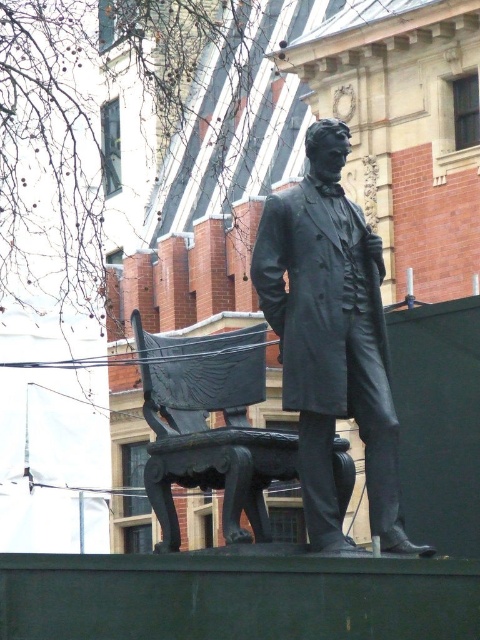
You are a tourist visiting a park and see the matte black statue at center and the black polished wood bench at center. Which object is closer to you?

The matte black statue at center is closer to you because it is in front of the black polished wood bench at center.

You are an art curator planning to move the matte black statue at center and the black polished wood bench at center to a new exhibition space. The new space has a height restriction of 1.8 meters. Given that the statue is smaller than the bench, which object is more likely to fit within the height limit?

The matte black statue at center is smaller than the black polished wood bench at center, so the statue is more likely to fit within the 1.8 meter height restriction.

You are a visitor at a park and see the matte black statue at center and the black polished wood bench at center. You want to sit on the bench but need to know if you can comfortably walk around the statue to reach it. Assuming an average person has a stride length of 0.75 meters, how many steps would it take to walk from the statue to the bench?

The matte black statue at center is 3.09 meters from the black polished wood bench at center. With an average stride length of 0.75 meters, dividing 3.09 by 0.75 gives approximately 4.12 steps. Since you can only take whole steps, it would take about 4 steps to walk from the matte black statue at center to the black polished wood bench at center.